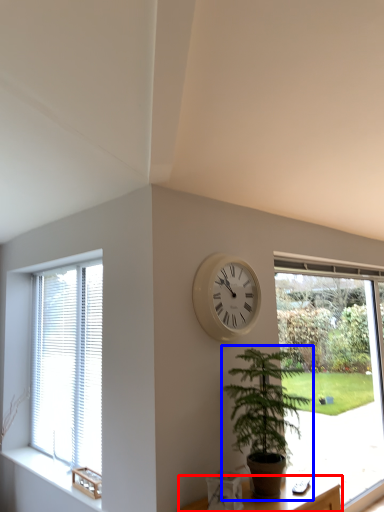
Question: Which point is closer to the camera, furniture (highlighted by a red box) or houseplant (highlighted by a blue box)?

Choices:
 (A) furniture
 (B) houseplant

Answer: (A)